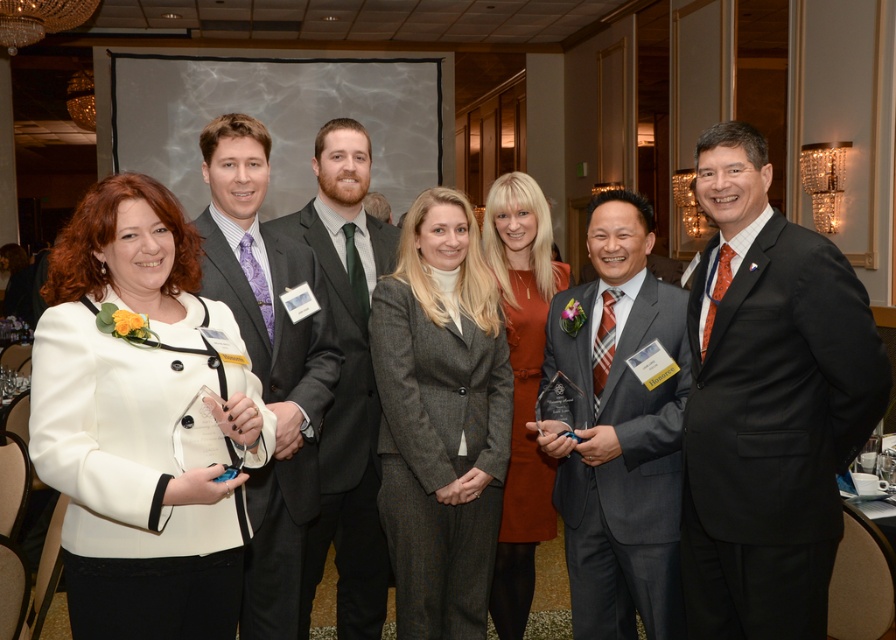
You are a photographer adjusting the camera settings to ensure all attendees are in focus. The gray wool suit at center and the matte purple tie at left are both in your frame. Which of these two items requires you to adjust the focus to a closer distance?

The matte purple tie at left requires adjusting the focus to a closer distance because the gray wool suit at center is not as tall as the matte purple tie at left, meaning the matte purple tie is closer to the camera.

You are a photographer adjusting the camera settings to ensure all attendees are in focus. The white matte blazer at left and the gray wool suit at center are two key subjects. Which subject requires more space between them to avoid blurring due to their sizes?

The white matte blazer at left requires more space between it and the gray wool suit at center because its width surpasses the gray wool suit at center, necessitating a greater distance to maintain focus clarity.

You are a photographer adjusting the camera angle to ensure all attendees are visible. The white matte blazer at left and the gray suit at center are in your frame. Which one is positioned higher in the image?

The white matte blazer at left is above the gray suit at center, so it is positioned higher in the image.